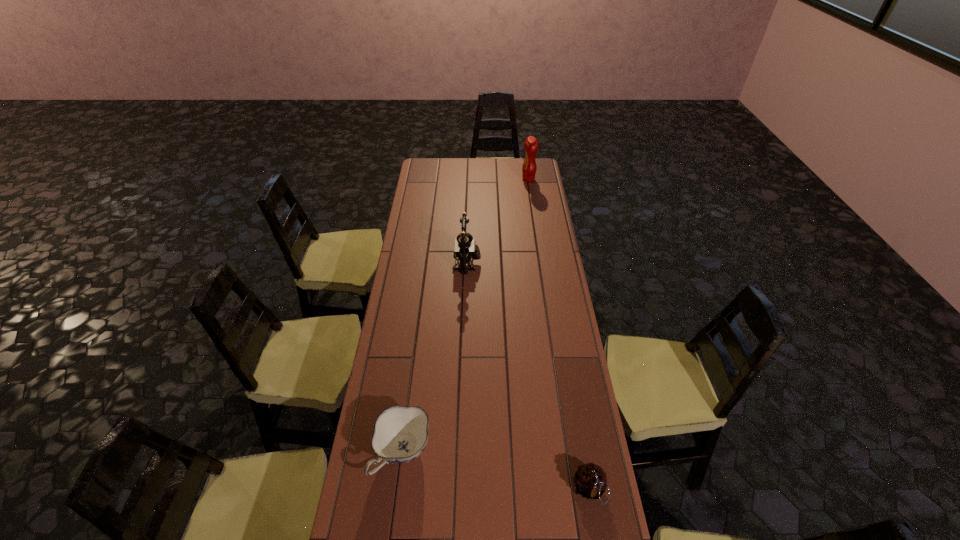
Where is `the farthest object`? The height and width of the screenshot is (540, 960). the farthest object is located at coordinates (531, 145).

Where is `the third nearest object`? This screenshot has width=960, height=540. the third nearest object is located at coordinates pos(464,247).

The image size is (960, 540). Identify the location of the third object from right to left. (464, 247).

Find the location of `the leftmost object`. the leftmost object is located at coordinates (400, 435).

Locate an element on the screen. pinecone is located at coordinates (590, 480).

Locate an element on the screen. This screenshot has height=540, width=960. vacant region located on the label side of the farthest object is located at coordinates (473, 179).

You are a GUI agent. You are given a task and a screenshot of the screen. Output one action in this format:
    pyautogui.click(x=<x>, y=<y>)
    Task: Click on the free region located on the label side of the farthest object
    The image size is (960, 540).
    Given the screenshot: What is the action you would take?
    pyautogui.click(x=465, y=179)

You are a GUI agent. You are given a task and a screenshot of the screen. Output one action in this format:
    pyautogui.click(x=<x>, y=<y>)
    Task: Click on the vacant space located on the label side of the farthest object
    This screenshot has height=540, width=960.
    Given the screenshot: What is the action you would take?
    pyautogui.click(x=506, y=179)

Where is `free space located 0.300m on the rotary dial of the third object from right to left`? This screenshot has height=540, width=960. free space located 0.300m on the rotary dial of the third object from right to left is located at coordinates (546, 263).

In order to click on free region located 0.380m on the back of the chinaware in this screenshot , I will do `click(418, 334)`.